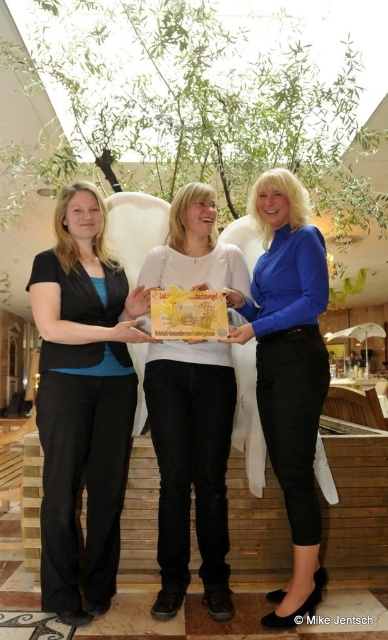
Question: Considering the real-world distances, which object is closest to the white matte gift box at center?

Choices:
 (A) blue satin blouse at center
 (B) matte black pants at left

Answer: (B)

Question: Which point is closer to the camera taking this photo?

Choices:
 (A) (81, 211)
 (B) (183, 429)
 (C) (254, 193)

Answer: (B)

Question: Is white matte gift box at center thinner than blue satin blouse at center?

Choices:
 (A) yes
 (B) no

Answer: (A)

Question: Is white matte gift box at center positioned before blue satin blouse at center?

Choices:
 (A) yes
 (B) no

Answer: (B)

Question: Among these objects, which one is nearest to the camera?

Choices:
 (A) matte black pants at left
 (B) white matte gift box at center

Answer: (A)

Question: Is the position of white matte gift box at center more distant than that of blue satin blouse at center?

Choices:
 (A) yes
 (B) no

Answer: (A)